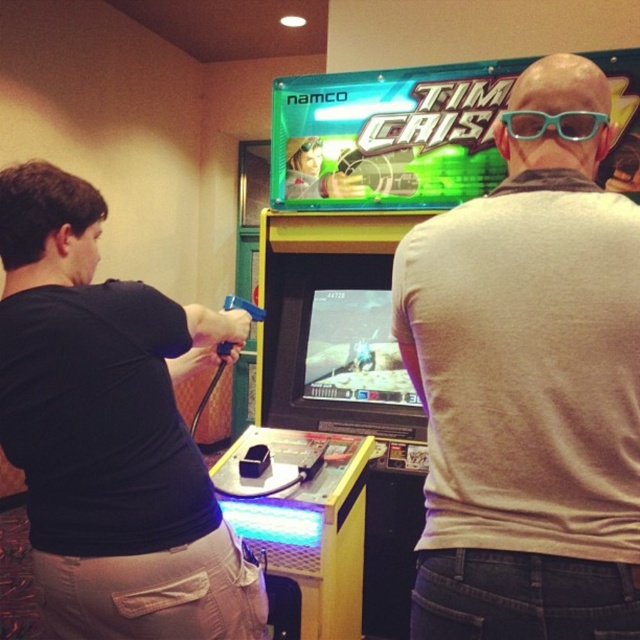
Based on the scene description, which object is positioned higher up in the image, the gray matte shirt at center or the teal plastic glasses at upper center?

The teal plastic glasses at upper center are positioned higher up in the image than the gray matte shirt at center.

You are standing in front of the Time Crisis arcade machine. You notice two objects near the center of the scene. One is the gray matte shirt at center and the other is the teal plastic glasses at upper center. Based on their positions, which object is closer to your left side?

The gray matte shirt at center is to the left of the teal plastic glasses at upper center, so the gray matte shirt at center is closer to your left side.

You are standing in front of the Time Crisis arcade machine and notice two items near the screen. The gray matte shirt at center and the teal plastic glasses at upper center. Which item is closer to the top of the screen?

The teal plastic glasses at upper center are closer to the top of the screen because they are positioned above the gray matte shirt at center.